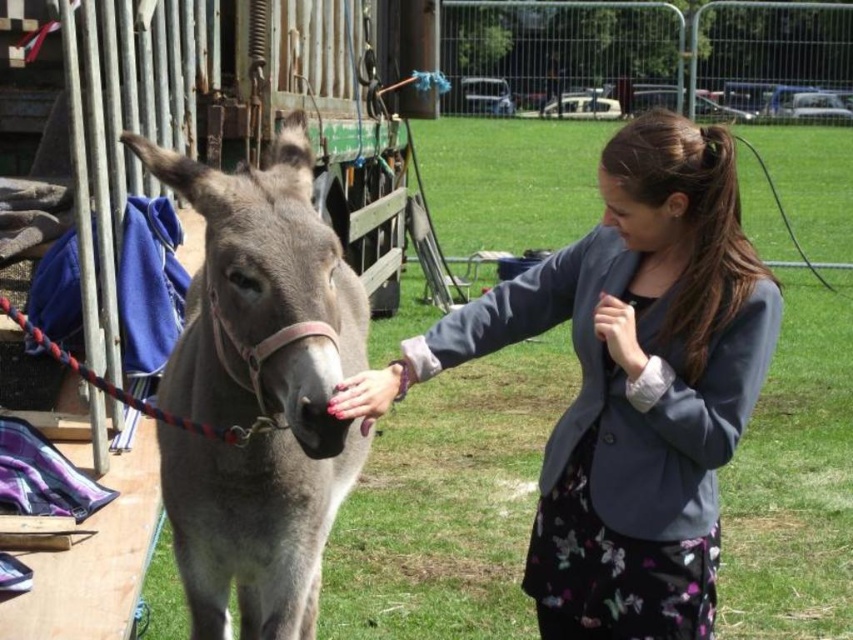
You are a photographer trying to capture a clear shot of both the matte gray blazer at center and the gray matte donkey at center. Based on their positions, which one should you focus on first to ensure both are in focus?

The matte gray blazer at center is closer to the viewer than the gray matte donkey at center, so you should focus on the matte gray blazer at center first to ensure both are in focus.

You are standing at the point with coordinates point (354, 465) and want to walk to the point with coordinates point (618, 412). Which direction should you move relative to the donkey and the person?

You should move towards the donkey and the person because point (618, 412) is in front of point (354, 465), meaning it is closer to the camera and in the direction of the donkey and person who are positioned on the left and right sides respectively.

You are a photographer trying to capture a closeup of the matte gray blazer at center and the gray matte donkey at center in the scene. What is the minimum distance you need to maintain between the camera and the subjects to ensure both are in focus?

The minimum distance you need to maintain between the camera and the subjects to ensure both the matte gray blazer at center and the gray matte donkey at center are in focus is 20.67 inches, as that is the distance between them.